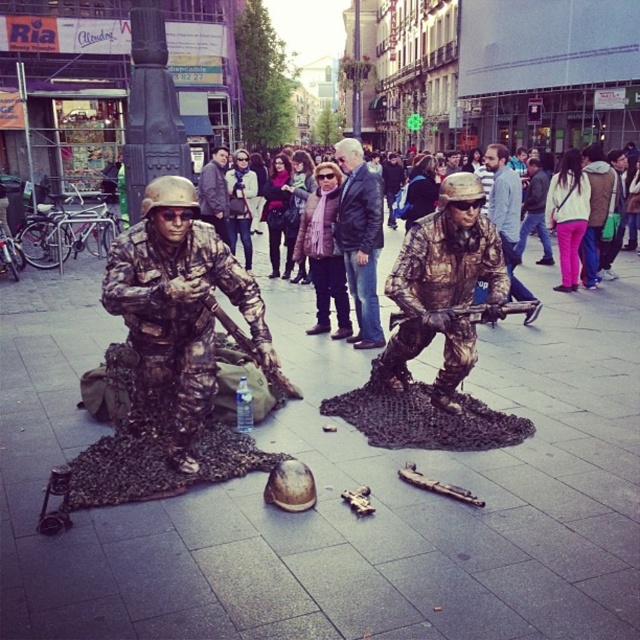
Question: Is camouflage fabric at center above bronze statue at center?

Choices:
 (A) yes
 (B) no

Answer: (B)

Question: Which is farther from the bronze statue at center?

Choices:
 (A) brushed metal helmet at center
 (B) camouflage paint soldier at left

Answer: (A)

Question: Considering the real-world distances, which object is farthest from the camouflage paint soldier at left?

Choices:
 (A) camouflage fabric at center
 (B) camouflage fabric soldier at center

Answer: (B)

Question: Is camouflage fabric at center positioned at the back of bronze statue at center?

Choices:
 (A) yes
 (B) no

Answer: (B)

Question: Does camouflage paint soldier at left have a smaller size compared to camouflage fabric soldier at center?

Choices:
 (A) no
 (B) yes

Answer: (B)

Question: Which point is closer to the camera taking this photo?

Choices:
 (A) (198, 193)
 (B) (493, 195)

Answer: (B)